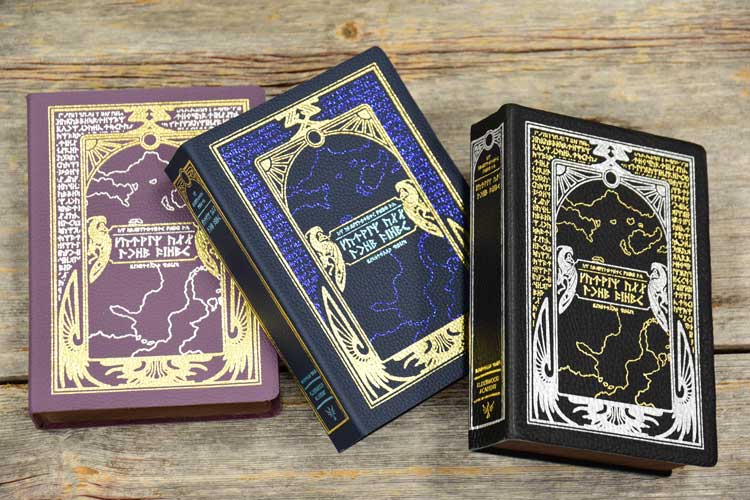
The image size is (750, 500). I want to click on dark magenta color of book, so pos(34,235).